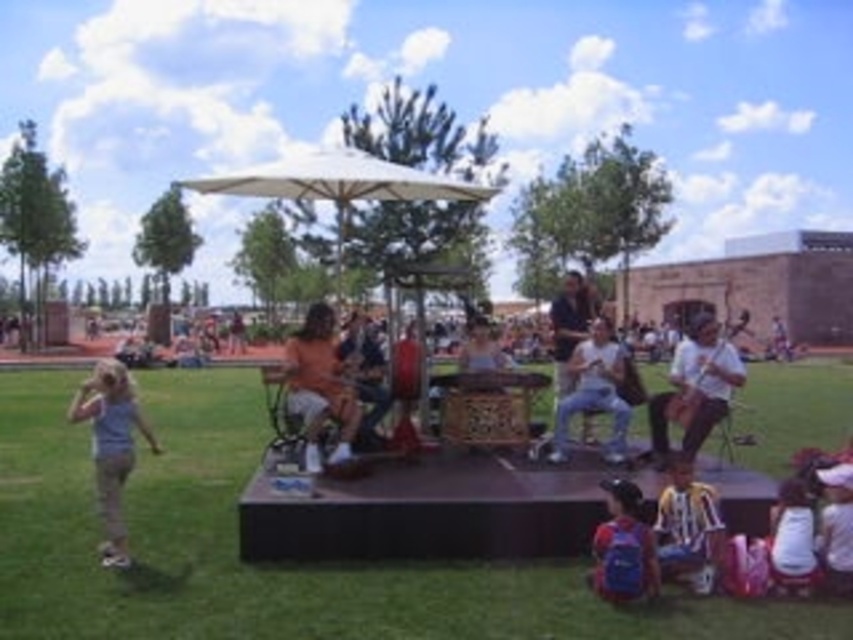
The image size is (853, 640). What do you see at coordinates (695, 387) in the screenshot? I see `white fabric drum at right` at bounding box center [695, 387].

Image resolution: width=853 pixels, height=640 pixels. In order to click on white fabric drum at right in this screenshot , I will do `click(695, 387)`.

Which is more to the left, green grass at center or light blue fabric at lower left?

light blue fabric at lower left

Between point (236, 531) and point (119, 372), which one is positioned in front?

Point (119, 372)

Is point (310, 632) positioned before point (129, 394)?

That is True.

Identify the location of green grass at center. This screenshot has width=853, height=640. (273, 563).

Between point (61, 490) and point (694, 440), which one is positioned in front?

Point (694, 440) is in front.

How far apart are green grass at center and white fabric drum at right?

green grass at center and white fabric drum at right are 8.96 meters apart.

At what (x,y) coordinates should I click in order to perform the action: click on green grass at center. Please return your answer as a coordinate pair (x, y). Looking at the image, I should click on (273, 563).